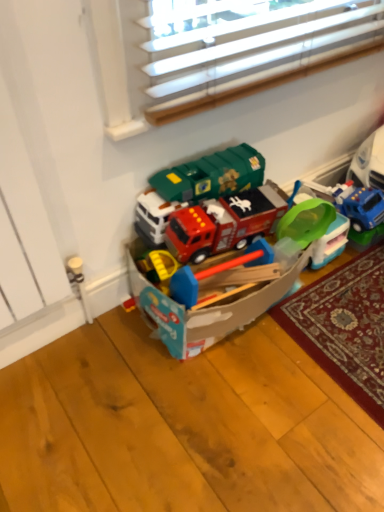
You are a GUI agent. You are given a task and a screenshot of the screen. Output one action in this format:
    pyautogui.click(x=<x>, y=<y>)
    Task: Click on the translucent plastic bucket at center, which is the 1th toy from right to left
    
    Given the screenshot: What is the action you would take?
    pyautogui.click(x=316, y=229)

Image resolution: width=384 pixels, height=512 pixels. What do you see at coordinates (316, 229) in the screenshot?
I see `translucent plastic bucket at center, which is the 1th toy from right to left` at bounding box center [316, 229].

Find the location of a particular element. This screenshot has width=384, height=512. matte plastic toy box at center, which is the 1th toy in left-to-right order is located at coordinates (221, 287).

What is the approximate width of matte plastic toy box at center, the second toy positioned from the right?

matte plastic toy box at center, the second toy positioned from the right, is 38.76 centimeters wide.

What do you see at coordinates (221, 287) in the screenshot? Image resolution: width=384 pixels, height=512 pixels. I see `matte plastic toy box at center, the second toy positioned from the right` at bounding box center [221, 287].

Identify the location of translucent plastic bucket at center, which is the 1th toy from right to left. coord(316,229).

Does matte plastic toy box at center, which is the 1th toy in left-to-right order, appear on the right side of translucent plastic bucket at center, which is the 2th toy from left to right?

Incorrect, matte plastic toy box at center, which is the 1th toy in left-to-right order, is not on the right side of translucent plastic bucket at center, which is the 2th toy from left to right.

Considering the positions of objects matte plastic toy box at center, which is the 1th toy in left-to-right order, and translucent plastic bucket at center, which is the 2th toy from left to right, in the image provided, who is in front, matte plastic toy box at center, which is the 1th toy in left-to-right order, or translucent plastic bucket at center, which is the 2th toy from left to right,?

matte plastic toy box at center, which is the 1th toy in left-to-right order, is closer to the camera.

Does point (230, 301) appear closer or farther from the camera than point (340, 224)?

Point (230, 301) is positioned closer to the camera compared to point (340, 224).

From the image's perspective, between matte plastic toy box at center, which is the 1th toy in left-to-right order, and translucent plastic bucket at center, which is the 2th toy from left to right, who is located below?

From the image's view, matte plastic toy box at center, which is the 1th toy in left-to-right order, is below.

From a real-world perspective, is matte plastic toy box at center, which is the 1th toy in left-to-right order, located higher than translucent plastic bucket at center, which is the 2th toy from left to right?

Yes.

Considering the relative sizes of matte plastic toy box at center, which is the 1th toy in left-to-right order, and translucent plastic bucket at center, which is the 2th toy from left to right, in the image provided, is matte plastic toy box at center, which is the 1th toy in left-to-right order, thinner than translucent plastic bucket at center, which is the 2th toy from left to right,?

No, matte plastic toy box at center, which is the 1th toy in left-to-right order, is not thinner than translucent plastic bucket at center, which is the 2th toy from left to right.

Considering the relative sizes of matte plastic toy box at center, the second toy positioned from the right, and translucent plastic bucket at center, which is the 1th toy from right to left, in the image provided, is matte plastic toy box at center, the second toy positioned from the right, shorter than translucent plastic bucket at center, which is the 1th toy from right to left,?

In fact, matte plastic toy box at center, the second toy positioned from the right, may be taller than translucent plastic bucket at center, which is the 1th toy from right to left.

Based on their sizes in the image, would you say matte plastic toy box at center, which is the 1th toy in left-to-right order, is bigger or smaller than translucent plastic bucket at center, which is the 2th toy from left to right?

Considering their sizes, matte plastic toy box at center, which is the 1th toy in left-to-right order, takes up more space than translucent plastic bucket at center, which is the 2th toy from left to right.

Do you think matte plastic toy box at center, the second toy positioned from the right, is within translucent plastic bucket at center, which is the 1th toy from right to left, or outside of it?

matte plastic toy box at center, the second toy positioned from the right, is spatially situated outside translucent plastic bucket at center, which is the 1th toy from right to left.

Are matte plastic toy box at center, the second toy positioned from the right, and translucent plastic bucket at center, which is the 1th toy from right to left, located far from each other?

Actually, matte plastic toy box at center, the second toy positioned from the right, and translucent plastic bucket at center, which is the 1th toy from right to left, are a little close together.

Could you tell me if matte plastic toy box at center, which is the 1th toy in left-to-right order, is facing translucent plastic bucket at center, which is the 1th toy from right to left?

No, matte plastic toy box at center, which is the 1th toy in left-to-right order, is not facing towards translucent plastic bucket at center, which is the 1th toy from right to left.

Can you tell me how much matte plastic toy box at center, the second toy positioned from the right, and translucent plastic bucket at center, which is the 2th toy from left to right, differ in facing direction?

There is a 0.000485-degree angle between the facing directions of matte plastic toy box at center, the second toy positioned from the right, and translucent plastic bucket at center, which is the 2th toy from left to right.

In the image, there is a translucent plastic bucket at center, which is the 2th toy from left to right. At what (x,y) coordinates should I click in order to perform the action: click on toy below it (from the image's perspective). Please return your answer as a coordinate pair (x, y). The height and width of the screenshot is (512, 384). Looking at the image, I should click on (221, 287).

Considering the relative positions of translucent plastic bucket at center, which is the 2th toy from left to right, and matte plastic toy box at center, the second toy positioned from the right, in the image provided, is translucent plastic bucket at center, which is the 2th toy from left to right, to the left or to the right of matte plastic toy box at center, the second toy positioned from the right,?

Based on their positions, translucent plastic bucket at center, which is the 2th toy from left to right, is located to the right of matte plastic toy box at center, the second toy positioned from the right.

Does translucent plastic bucket at center, which is the 2th toy from left to right, come behind matte plastic toy box at center, which is the 1th toy in left-to-right order?

Yes, it is behind matte plastic toy box at center, which is the 1th toy in left-to-right order.

Which is in front, point (319, 227) or point (217, 268)?

The point (217, 268) is closer to the camera.

From the image's perspective, does translucent plastic bucket at center, which is the 1th toy from right to left, appear lower than matte plastic toy box at center, the second toy positioned from the right?

Actually, translucent plastic bucket at center, which is the 1th toy from right to left, appears above matte plastic toy box at center, the second toy positioned from the right, in the image.

In the scene shown: From a real-world perspective, which object stands above the other?

matte plastic toy box at center, the second toy positioned from the right, is physically above.

Which object is thinner, translucent plastic bucket at center, which is the 2th toy from left to right, or matte plastic toy box at center, the second toy positioned from the right?

With smaller width is translucent plastic bucket at center, which is the 2th toy from left to right.

Considering the relative sizes of translucent plastic bucket at center, which is the 1th toy from right to left, and matte plastic toy box at center, the second toy positioned from the right, in the image provided, is translucent plastic bucket at center, which is the 1th toy from right to left, taller than matte plastic toy box at center, the second toy positioned from the right,?

No.

Based on their sizes in the image, would you say translucent plastic bucket at center, which is the 1th toy from right to left, is bigger or smaller than matte plastic toy box at center, which is the 1th toy in left-to-right order?

In the image, translucent plastic bucket at center, which is the 1th toy from right to left, appears to be smaller than matte plastic toy box at center, which is the 1th toy in left-to-right order.

Is translucent plastic bucket at center, which is the 2th toy from left to right, spatially inside matte plastic toy box at center, which is the 1th toy in left-to-right order, or outside of it?

translucent plastic bucket at center, which is the 2th toy from left to right, is not inside matte plastic toy box at center, which is the 1th toy in left-to-right order, it's outside.

Are translucent plastic bucket at center, which is the 2th toy from left to right, and matte plastic toy box at center, the second toy positioned from the right, far apart?

That's not correct — translucent plastic bucket at center, which is the 2th toy from left to right, is a little close to matte plastic toy box at center, the second toy positioned from the right.

Is translucent plastic bucket at center, which is the 2th toy from left to right, positioned with its back to matte plastic toy box at center, the second toy positioned from the right?

No, matte plastic toy box at center, the second toy positioned from the right, is not at the back of translucent plastic bucket at center, which is the 2th toy from left to right.

Locate an element on the screen. toy in front of the translucent plastic bucket at center, which is the 2th toy from left to right is located at coordinates (221, 287).

Where is `toy on the left of translucent plastic bucket at center, which is the 2th toy from left to right`? This screenshot has width=384, height=512. toy on the left of translucent plastic bucket at center, which is the 2th toy from left to right is located at coordinates (221, 287).

You are a GUI agent. You are given a task and a screenshot of the screen. Output one action in this format:
    pyautogui.click(x=<x>, y=<y>)
    Task: Click on the toy on the right of matte plastic toy box at center, the second toy positioned from the right
    This screenshot has height=512, width=384.
    Given the screenshot: What is the action you would take?
    pyautogui.click(x=316, y=229)